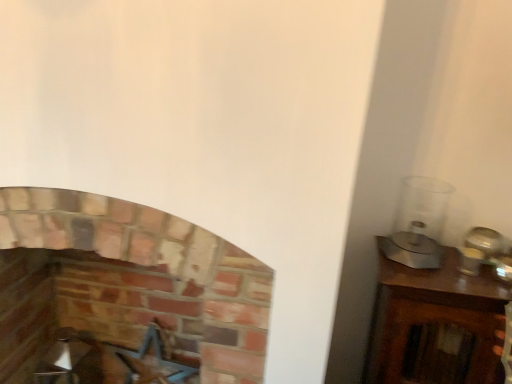
Question: From the image's perspective, is metallic blue swivel chair at lower left above or below brick fireplace at center?

Choices:
 (A) above
 (B) below

Answer: (B)

Question: From a real-world perspective, is metallic blue swivel chair at lower left physically located above or below brick fireplace at center?

Choices:
 (A) above
 (B) below

Answer: (B)

Question: Is metallic blue swivel chair at lower left spatially inside brick fireplace at center, or outside of it?

Choices:
 (A) inside
 (B) outside

Answer: (A)

Question: From the image's perspective, is brick fireplace at center above or below metallic blue swivel chair at lower left?

Choices:
 (A) above
 (B) below

Answer: (A)

Question: In the image, is brick fireplace at center on the left side or the right side of metallic blue swivel chair at lower left?

Choices:
 (A) right
 (B) left

Answer: (B)

Question: Which is correct: brick fireplace at center is inside metallic blue swivel chair at lower left, or outside of it?

Choices:
 (A) inside
 (B) outside

Answer: (B)

Question: Considering the positions of brick fireplace at center and metallic blue swivel chair at lower left in the image, is brick fireplace at center taller or shorter than metallic blue swivel chair at lower left?

Choices:
 (A) short
 (B) tall

Answer: (B)